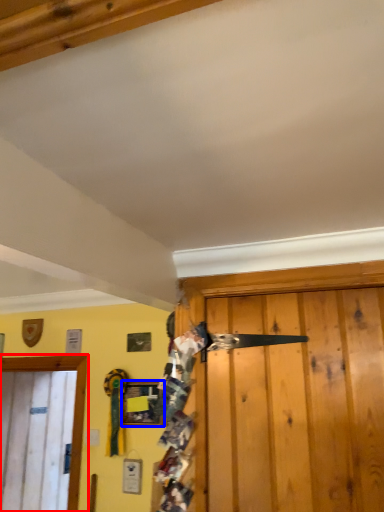
Question: Which point is further to the camera, door (highlighted by a red box) or picture frame (highlighted by a blue box)?

Choices:
 (A) door
 (B) picture frame

Answer: (A)